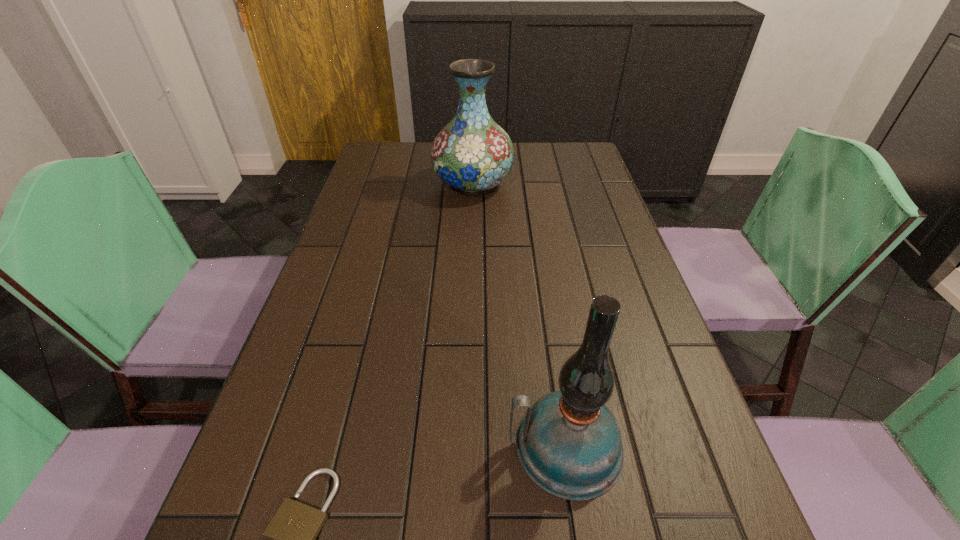
Locate an element on the screen. This screenshot has height=540, width=960. empty space that is in between the vase and the oil lamp is located at coordinates (519, 315).

Find the location of `vacant space that is in between the oil lamp and the vase`. vacant space that is in between the oil lamp and the vase is located at coordinates (519, 315).

Identify the location of blank region between the oil lamp and the vase. (519, 315).

Image resolution: width=960 pixels, height=540 pixels. Find the location of `the closest object relative to the leftmost object`. the closest object relative to the leftmost object is located at coordinates (569, 443).

Choose which object is the nearest neighbor to the padlock. Please provide its 2D coordinates. Your answer should be formatted as a tuple, i.e. [(x, y)], where the tuple contains the x and y coordinates of a point satisfying the conditions above.

[(569, 443)]